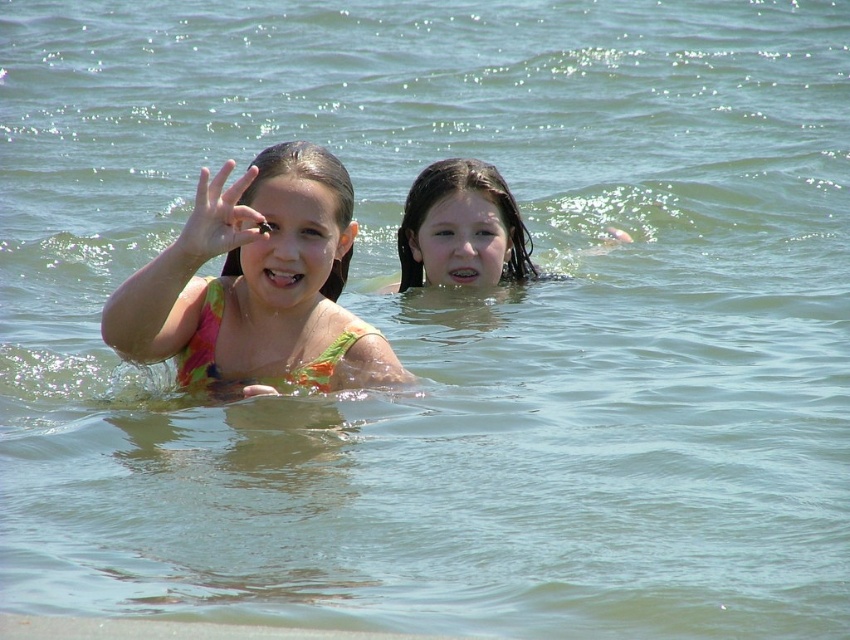
Question: Is the position of multicolored fabric bikini at center less distant than that of wet hair at center?

Choices:
 (A) yes
 (B) no

Answer: (A)

Question: From the image, what is the correct spatial relationship of multicolored fabric bikini at center in relation to wet hair at center?

Choices:
 (A) right
 (B) left

Answer: (B)

Question: Which point appears closest to the camera in this image?

Choices:
 (A) (435, 221)
 (B) (272, 376)

Answer: (B)

Question: Which point is closer to the camera?

Choices:
 (A) multicolored fabric bikini at center
 (B) wet hair at center

Answer: (A)

Question: Does multicolored fabric bikini at center have a larger size compared to wet hair at center?

Choices:
 (A) yes
 (B) no

Answer: (A)